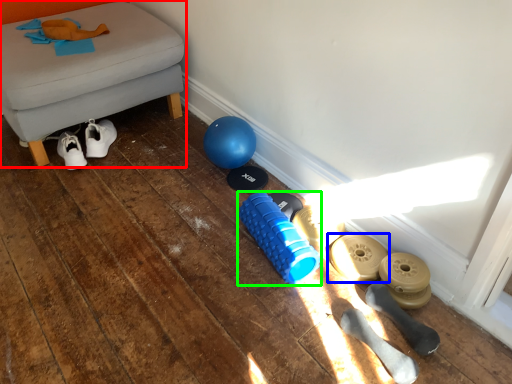
Question: Which is farther away from furniture (highlighted by a red box)? footwear (highlighted by a blue box) or dumbbell (highlighted by a green box)?

Choices:
 (A) footwear
 (B) dumbbell

Answer: (A)